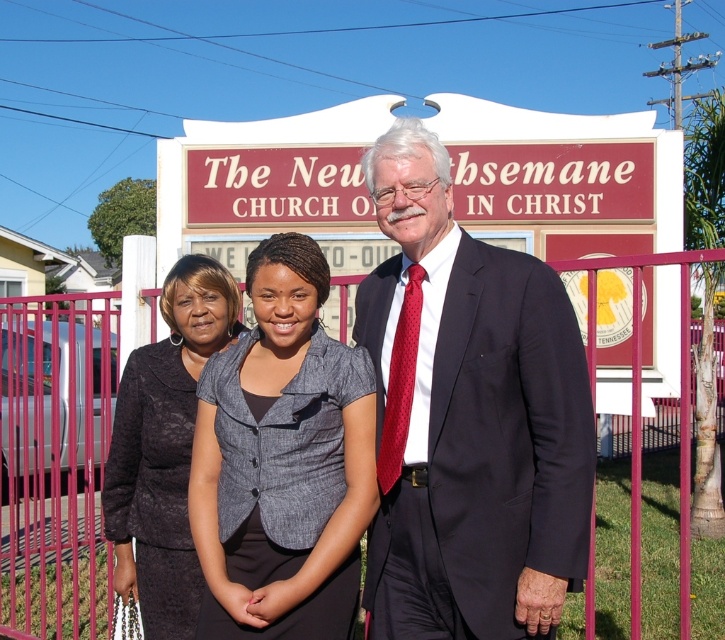
Who is positioned more to the left, gray textured blazer at center or dark gray textured blazer at center?

dark gray textured blazer at center is more to the left.

Does gray textured blazer at center have a greater width compared to dark gray textured blazer at center?

Indeed, gray textured blazer at center has a greater width compared to dark gray textured blazer at center.

Who is more distant from viewer, (228,483) or (125,582)?

The point (125,582) is behind.

Identify the location of gray textured blazer at center. (281, 461).

Can you confirm if navy blue suit at center is shorter than dark gray textured blazer at center?

Incorrect, navy blue suit at center's height does not fall short of dark gray textured blazer at center's.

Which is behind, point (534, 609) or point (112, 428)?

The point (112, 428) is more distant.

You are a GUI agent. You are given a task and a screenshot of the screen. Output one action in this format:
    pyautogui.click(x=<x>, y=<y>)
    Task: Click on the navy blue suit at center
    The width and height of the screenshot is (725, 640).
    Given the screenshot: What is the action you would take?
    pyautogui.click(x=468, y=417)

How much distance is there between navy blue suit at center and gray textured blazer at center?

A distance of 3.82 feet exists between navy blue suit at center and gray textured blazer at center.

Which of these two, navy blue suit at center or gray textured blazer at center, stands taller?

navy blue suit at center is taller.

Find the location of `navy blue suit at center`. navy blue suit at center is located at coordinates (468, 417).

At what (x,y) coordinates should I click in order to perform the action: click on navy blue suit at center. Please return your answer as a coordinate pair (x, y). The height and width of the screenshot is (640, 725). Looking at the image, I should click on point(468,417).